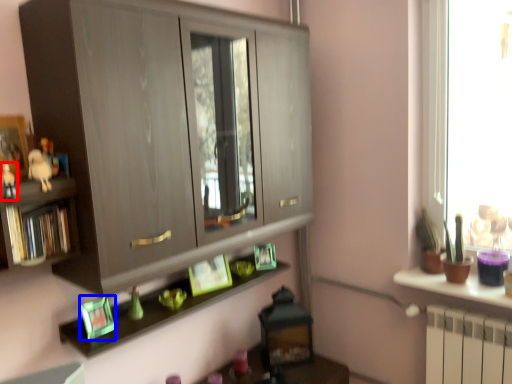
Question: Which of the following is the closest to the observer, toy (highlighted by a red box) or picture frame (highlighted by a blue box)?

Choices:
 (A) toy
 (B) picture frame

Answer: (A)